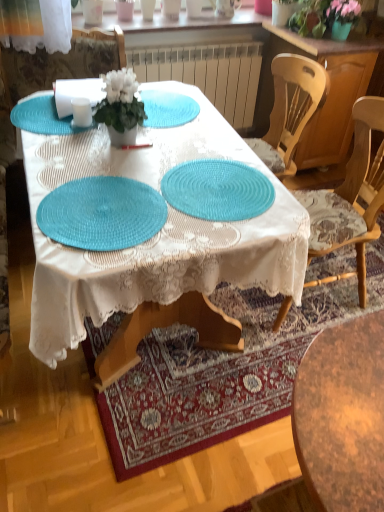
Identify the location of vacant space to the right of teal woven placemat at center, positioned as the 3th glass plate in top-to-bottom order. (213, 208).